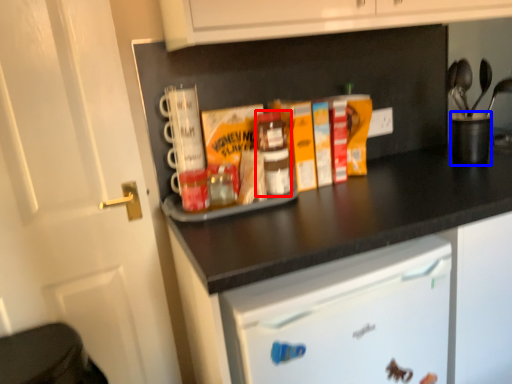
Question: Among these objects, which one is farthest to the camera, bottle (highlighted by a red box) or appliance (highlighted by a blue box)?

Choices:
 (A) bottle
 (B) appliance

Answer: (B)